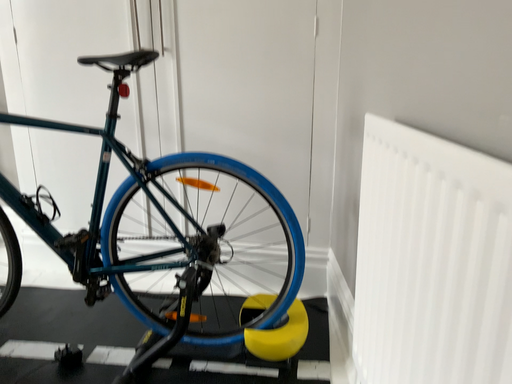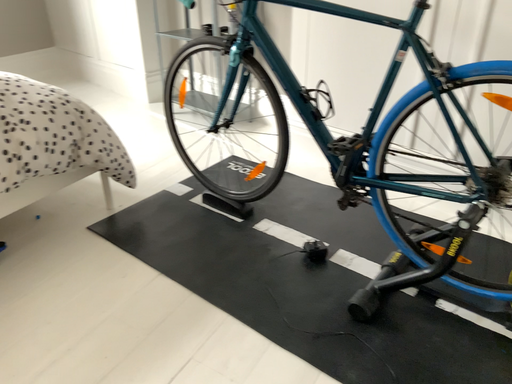
Question: How did the camera likely rotate when shooting the video?

Choices:
 (A) rotated right
 (B) rotated left

Answer: (B)